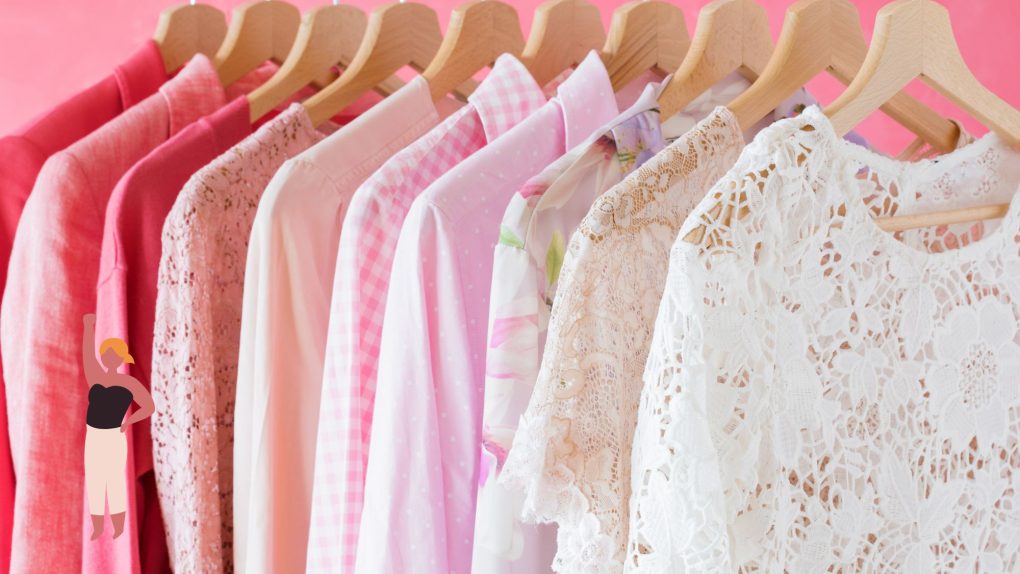
The width and height of the screenshot is (1020, 574). In order to click on garment on wooden clothes hanger in this screenshot , I will do `click(69, 120)`, `click(136, 126)`, `click(186, 145)`, `click(242, 159)`, `click(318, 172)`, `click(397, 188)`, `click(478, 195)`, `click(526, 205)`, `click(621, 218)`, `click(716, 236)`.